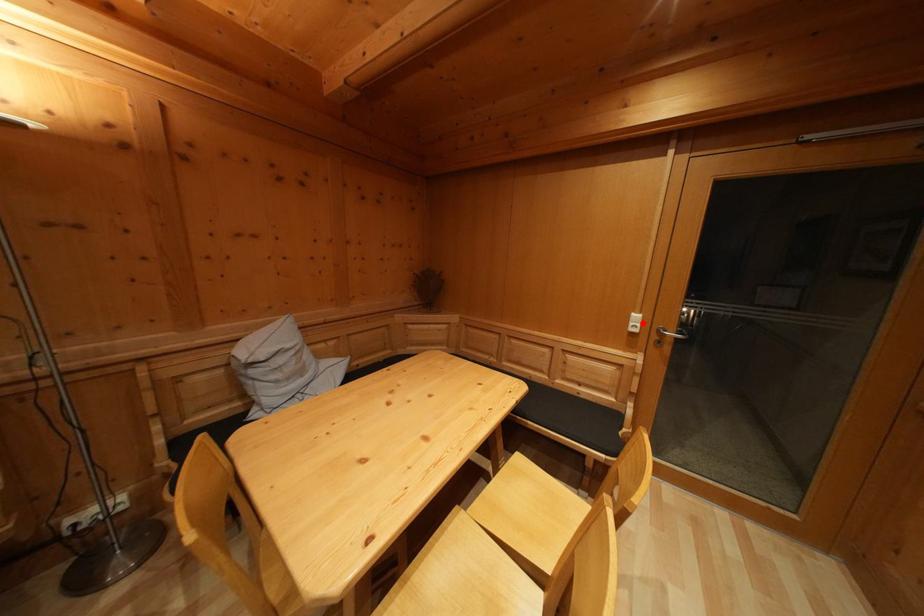
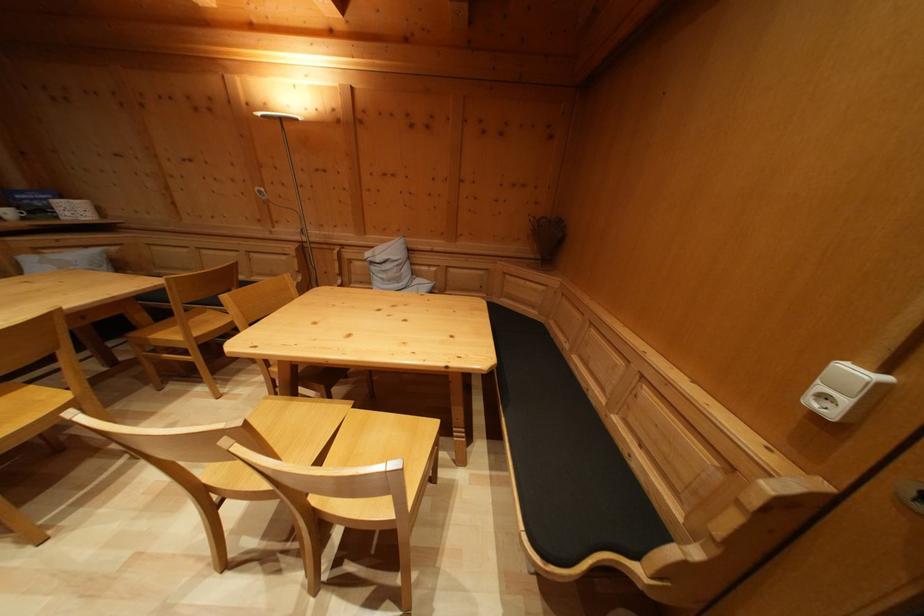
The point at the highlighted location is marked in the first image. Where is the corresponding point in the second image?

(859, 379)